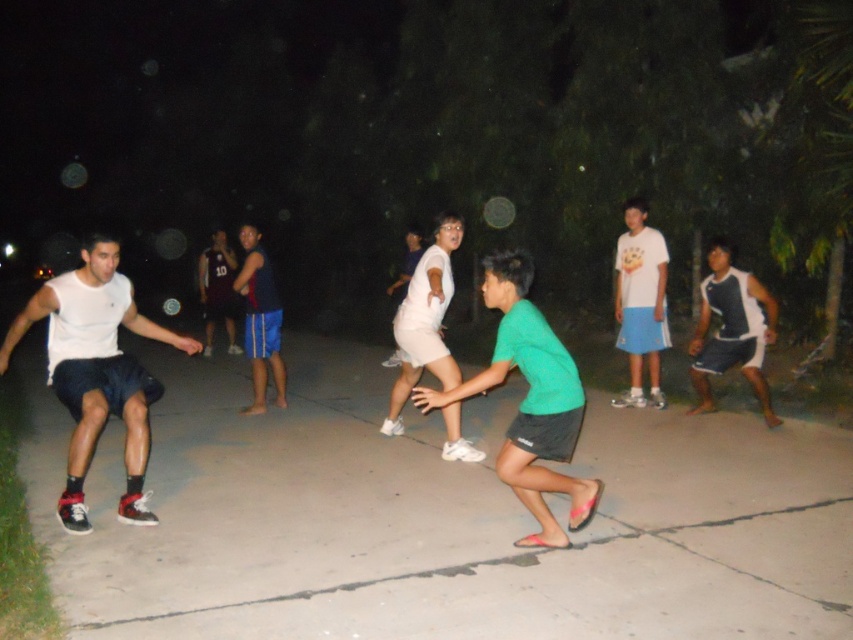
Question: Is green matte shirt at center above dark blue jersey at center?

Choices:
 (A) yes
 (B) no

Answer: (B)

Question: Can you confirm if white matte t-shirt at center is smaller than dark purple jersey at center?

Choices:
 (A) yes
 (B) no

Answer: (A)

Question: Considering the real-world distances, which object is closest to the dark blue jersey at center?

Choices:
 (A) green matte shirt at center
 (B) gray concrete pavement at center
 (C) dark purple jersey at center
 (D) white matte shorts at center

Answer: (D)

Question: Which object is the farthest from the white matte shorts at left?

Choices:
 (A) white matte t-shirt at center
 (B) white matte shorts at center
 (C) dark purple jersey at center

Answer: (C)

Question: Is green matte shirt at center to the left of white mesh tank top at right from the viewer's perspective?

Choices:
 (A) no
 (B) yes

Answer: (B)

Question: Among these objects, which one is nearest to the camera?

Choices:
 (A) green matte shirt at center
 (B) dark purple jersey at center
 (C) white mesh tank top at right
 (D) dark blue jersey at center

Answer: (A)